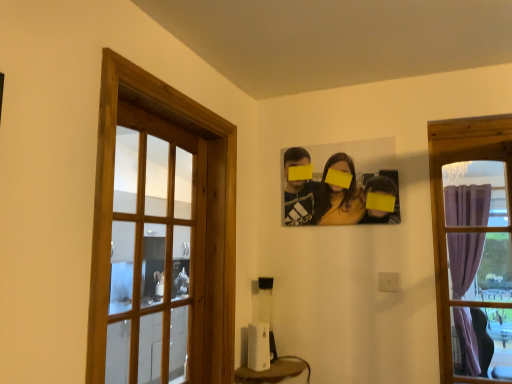
Question: Is purple curtain at right, placed as the first window when sorted from right to left, to the left or to the right of white plastic speaker at lower center in the image?

Choices:
 (A) right
 (B) left

Answer: (A)

Question: Is purple curtain at right, placed as the first window when sorted from right to left, taller or shorter than white plastic speaker at lower center?

Choices:
 (A) short
 (B) tall

Answer: (B)

Question: Considering the real-world distances, which object is farthest from the wooden frame at left, the 1th window from the left?

Choices:
 (A) white plastic speaker at lower center
 (B) matte black photo frame at upper center
 (C) purple curtain at right, the second window in the left-to-right sequence

Answer: (C)

Question: Based on their relative distances, which object is farther from the white plastic speaker at lower center?

Choices:
 (A) wooden frame at left, the 1th window from the left
 (B) matte black photo frame at upper center
 (C) purple curtain at right, placed as the first window when sorted from right to left

Answer: (C)